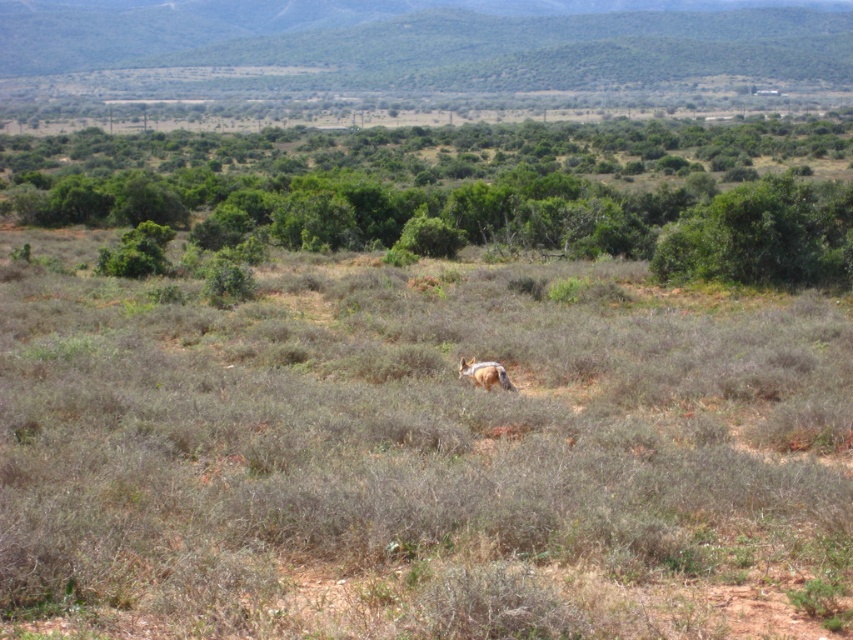
You are navigating through the dry landscape and need to reach a specific destination. You have two points marked on your map, point (x=123, y=172) and point (x=473, y=378). Which point is closer to your current position if you are standing at the starting point?

Point (x=123, y=172) is closer to your current position because it is further to the viewer compared to point (x=473, y=378), which is farther away.